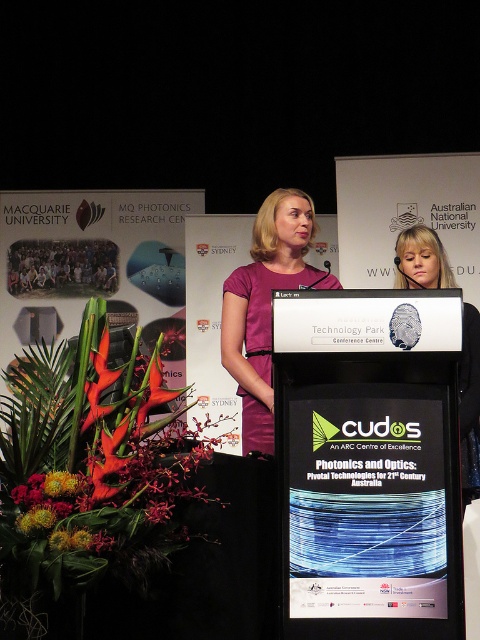
Question: Is purple matte dress at center to the right of matte purple dress at center from the viewer's perspective?

Choices:
 (A) no
 (B) yes

Answer: (A)

Question: Which point is closer to the camera?

Choices:
 (A) purple matte dress at center
 (B) matte purple dress at center

Answer: (B)

Question: Which point appears farthest from the camera in this image?

Choices:
 (A) (460, 440)
 (B) (300, 205)

Answer: (B)

Question: Can you confirm if purple matte dress at center is positioned below matte purple dress at center?

Choices:
 (A) yes
 (B) no

Answer: (B)

Question: Can you confirm if purple matte dress at center is bigger than matte purple dress at center?

Choices:
 (A) yes
 (B) no

Answer: (B)